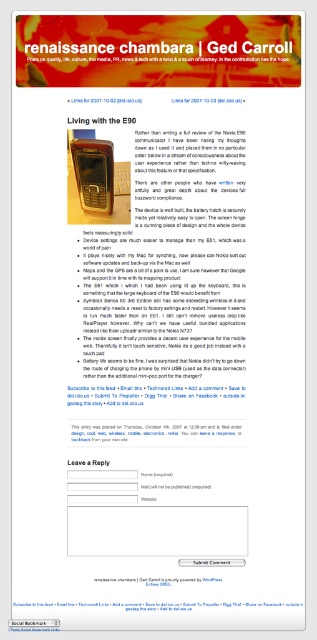
You are trying to locate the white paper at upper center on the webpage. Based on the scene description, where would you expect to find it?

The white paper at upper center is located at point (157, 604).

What is the relationship between the white paper at upper center and the brown leather wallet at upper center in terms of their positions?

The white paper at upper center is positioned in front of the brown leather wallet at upper center, indicating that it is closer to the viewer.

You are a user trying to read the content of the webpage. You notice two white papers, the white paper at upper center and the white paper at center. Which one is positioned higher on the page?

The white paper at center is positioned higher than the white paper at upper center.